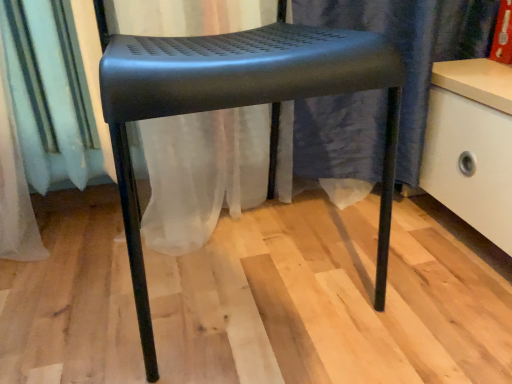
What is the approximate height of matte black stool at center?

It is 20.49 inches.

The image size is (512, 384). Identify the location of matte black stool at center. (239, 106).

Image resolution: width=512 pixels, height=384 pixels. Describe the element at coordinates (239, 106) in the screenshot. I see `matte black stool at center` at that location.

Identify the location of matte black stool at center. (239, 106).